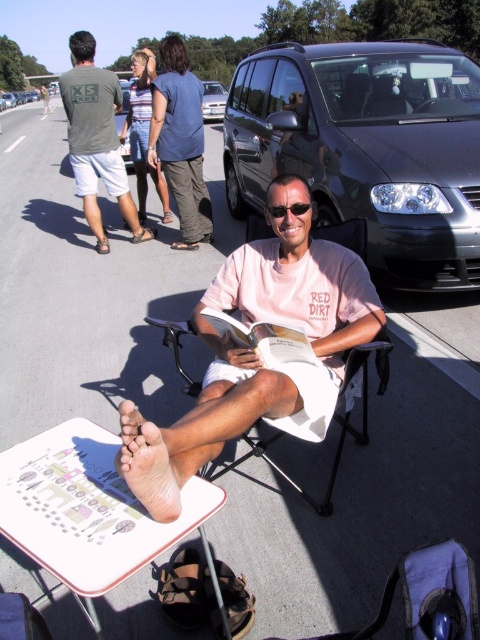
Question: Which object is closer to the camera taking this photo?

Choices:
 (A) white plastic chair at center
 (B) dark gray metallic van at center

Answer: (A)

Question: Is white paper book at center above sunglasses at center?

Choices:
 (A) no
 (B) yes

Answer: (A)

Question: Which point is farther from the camera taking this photo?

Choices:
 (A) [260, 227]
 (B) [365, 296]

Answer: (A)

Question: Considering the real-world distances, which object is closest to the matte green t-shirt at upper left?

Choices:
 (A) metallic silver car at upper center
 (B) dark gray metallic van at center
 (C) silver metallic van at upper center
 (D) white paper book at center

Answer: (B)

Question: Is matte green t-shirt at upper left positioned before white plastic chair at center?

Choices:
 (A) no
 (B) yes

Answer: (A)

Question: Does dark gray metallic van at center appear under silver metallic van at upper center?

Choices:
 (A) yes
 (B) no

Answer: (A)